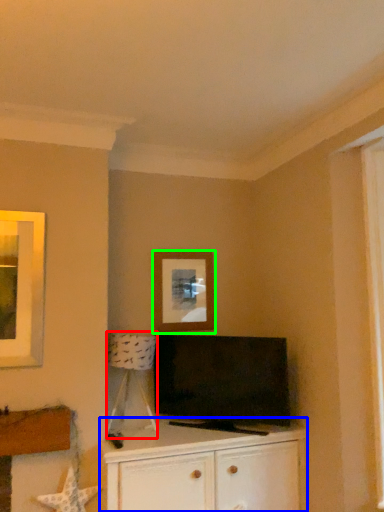
Question: Which object is positioned farthest from lamp (highlighted by a red box)? Select from cabinetry (highlighted by a blue box) and picture frame (highlighted by a green box).

Choices:
 (A) cabinetry
 (B) picture frame

Answer: (A)